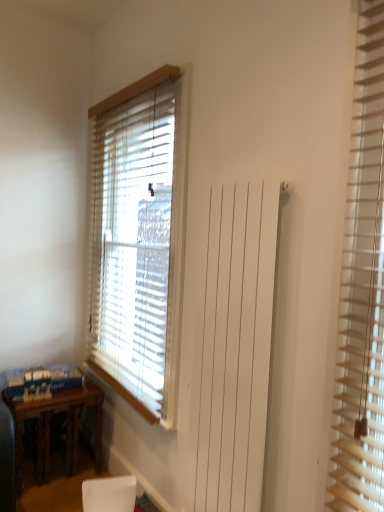
Question: Considering the relative sizes of brown wooden table at lower left and white matte armchair at lower center in the image provided, is brown wooden table at lower left bigger than white matte armchair at lower center?

Choices:
 (A) yes
 (B) no

Answer: (A)

Question: Is brown wooden table at lower left outside of white matte armchair at lower center?

Choices:
 (A) no
 (B) yes

Answer: (B)

Question: Is brown wooden table at lower left positioned far away from white matte armchair at lower center?

Choices:
 (A) no
 (B) yes

Answer: (A)

Question: Does brown wooden table at lower left have a greater height compared to white matte armchair at lower center?

Choices:
 (A) yes
 (B) no

Answer: (A)

Question: From the image's perspective, would you say brown wooden table at lower left is positioned over white matte armchair at lower center?

Choices:
 (A) no
 (B) yes

Answer: (B)

Question: Looking at their shapes, would you say wooden blinds at center, which is counted as the 2th window blind, starting from the front, is wider or thinner than white matte armchair at lower center?

Choices:
 (A) thin
 (B) wide

Answer: (A)

Question: Is wooden blinds at center, which is counted as the 1th window blind, starting from the left, bigger or smaller than white matte armchair at lower center?

Choices:
 (A) small
 (B) big

Answer: (B)

Question: Considering the positions of wooden blinds at center, which is counted as the 1th window blind, starting from the left, and white matte armchair at lower center in the image, is wooden blinds at center, which is counted as the 1th window blind, starting from the left, taller or shorter than white matte armchair at lower center?

Choices:
 (A) short
 (B) tall

Answer: (B)

Question: Is wooden blinds at center, which is counted as the 1th window blind, starting from the left, in front of or behind white matte armchair at lower center in the image?

Choices:
 (A) behind
 (B) front

Answer: (A)

Question: Would you say wooden blinds at center, the first window blind viewed from the back, is to the left or to the right of brown wooden table at lower left in the picture?

Choices:
 (A) left
 (B) right

Answer: (B)

Question: In the image, is wooden blinds at center, which appears as the second window blind when viewed from the right, positioned in front of or behind brown wooden table at lower left?

Choices:
 (A) front
 (B) behind

Answer: (A)

Question: Is point (150, 324) positioned closer to the camera than point (16, 429)?

Choices:
 (A) farther
 (B) closer

Answer: (B)

Question: From a real-world perspective, is wooden blinds at center, which is counted as the 2th window blind, starting from the front, positioned above or below brown wooden table at lower left?

Choices:
 (A) below
 (B) above

Answer: (B)

Question: Considering the positions of point (352, 253) and point (46, 456), is point (352, 253) closer or farther from the camera than point (46, 456)?

Choices:
 (A) closer
 (B) farther

Answer: (A)

Question: From the image's perspective, is wooden blinds at right, the 2th window blind in the back-to-front sequence, positioned above or below brown wooden table at lower left?

Choices:
 (A) above
 (B) below

Answer: (A)